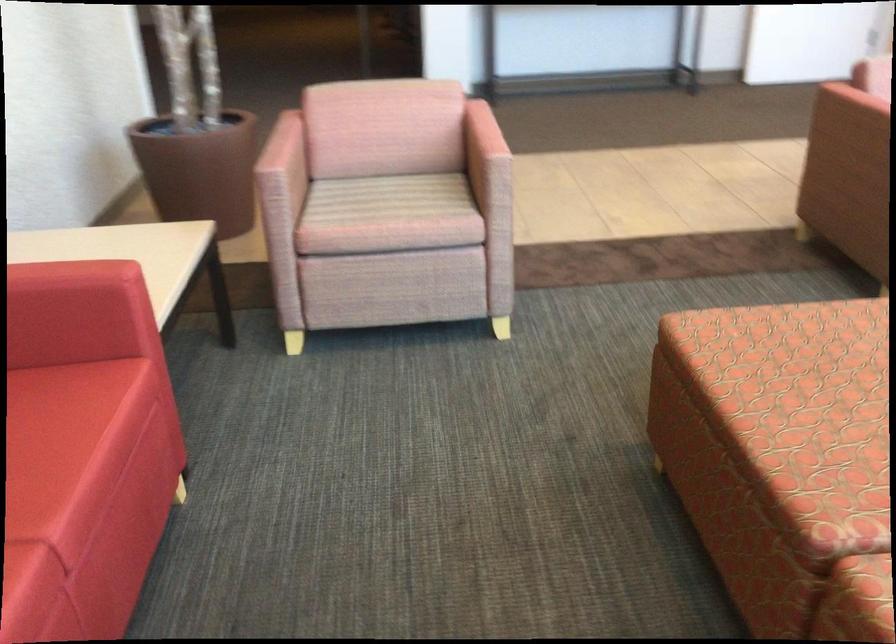
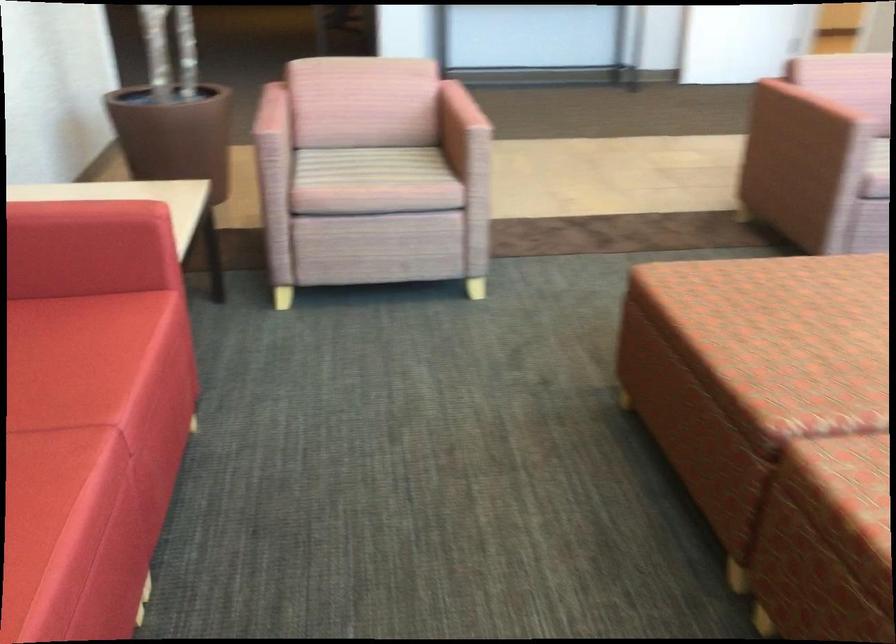
The point at (476, 146) is marked in the first image. Where is the corresponding point in the second image?

(459, 118)